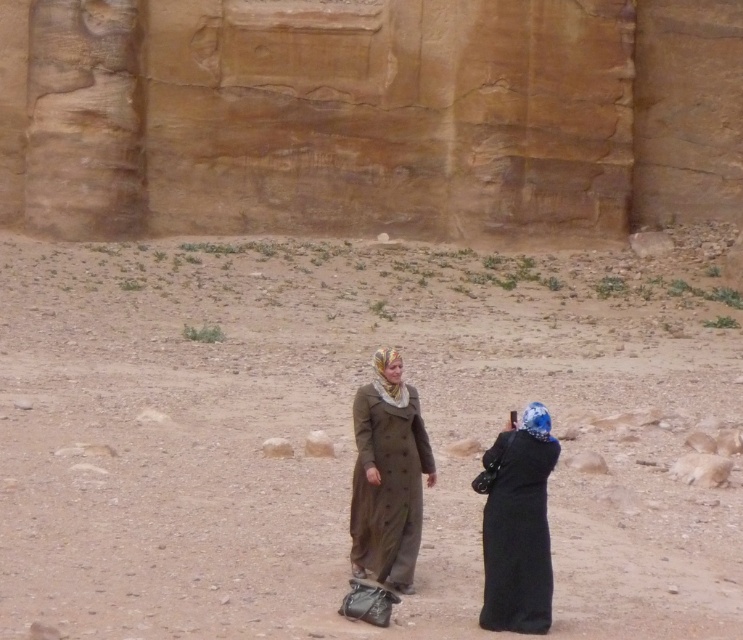
You are navigating a desert terrain and need to determine the order of two landmarks. The first landmark is at point (114, 422), and the second is at point (528, 540). Based on the scene, which point is closer to you?

Point (528, 540) is closer to you because the description states that point (114, 422) is behind point (528, 540).